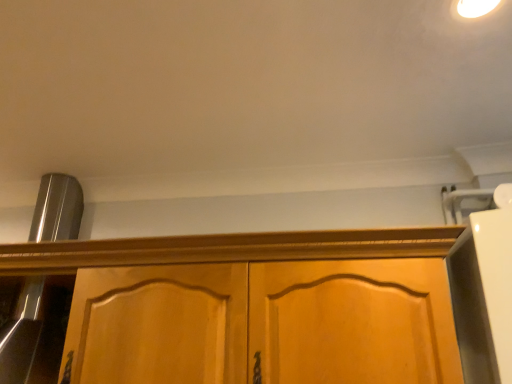
This screenshot has width=512, height=384. What do you see at coordinates (227, 249) in the screenshot?
I see `wooden cabinet at center` at bounding box center [227, 249].

This screenshot has width=512, height=384. What are the coordinates of `wooden cabinet at center` in the screenshot? It's located at (227, 249).

At what (x,y) coordinates should I click in order to perform the action: click on wooden cabinet at center. Please return your answer as a coordinate pair (x, y). The height and width of the screenshot is (384, 512). Looking at the image, I should click on (227, 249).